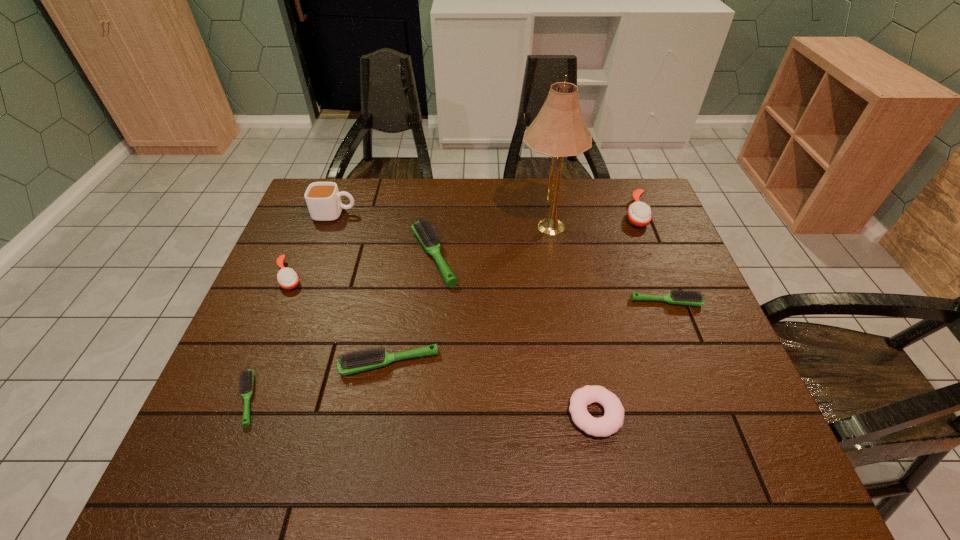
Locate an element on the screen. the third nearest light hairbrush is located at coordinates (679, 297).

Locate an element on the screen. the rightmost light hairbrush is located at coordinates (679, 297).

Locate an element on the screen. This screenshot has width=960, height=540. doughnut is located at coordinates (612, 421).

Locate an element on the screen. This screenshot has width=960, height=540. the shortest hairbrush is located at coordinates (246, 382).

Where is `the leftmost light hairbrush`? the leftmost light hairbrush is located at coordinates (246, 382).

This screenshot has height=540, width=960. In order to click on vacant space positioned 0.180m on the front of the beige lampshade in this screenshot , I will do `click(556, 294)`.

Where is `vacant area located 0.100m on the side with the handle of the cup`? The width and height of the screenshot is (960, 540). vacant area located 0.100m on the side with the handle of the cup is located at coordinates (389, 214).

Find the location of a particular element. The height and width of the screenshot is (540, 960). vacant region located on the left of the bigger orange hairbrush is located at coordinates (516, 213).

This screenshot has width=960, height=540. Find the location of `vacant area located 0.160m on the left of the farthest light hairbrush`. vacant area located 0.160m on the left of the farthest light hairbrush is located at coordinates (352, 256).

Find the location of a particular element. free space located on the front of the second biggest light hairbrush is located at coordinates (373, 460).